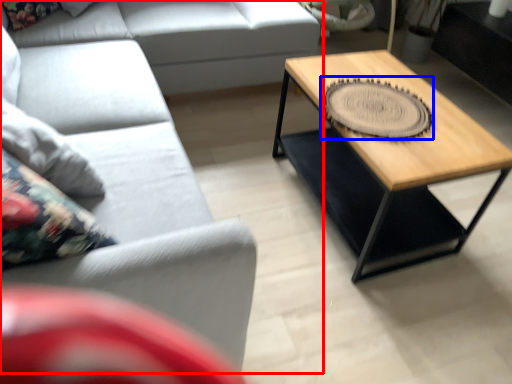
Question: Which of the following is the closest to the observer, studio couch (highlighted by a red box) or coaster (highlighted by a blue box)?

Choices:
 (A) studio couch
 (B) coaster

Answer: (A)